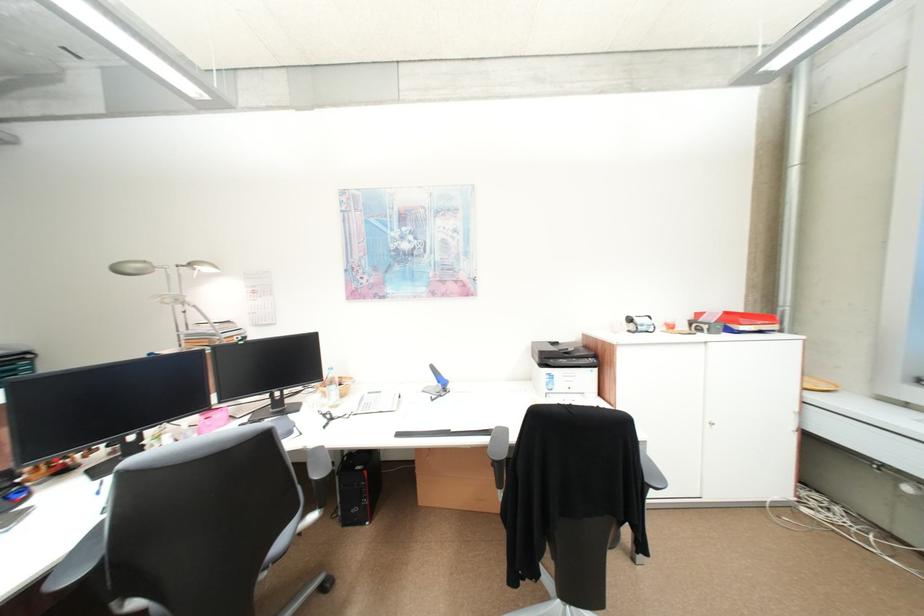
Where would you turn the white cabinet lock? Please return your answer as a coordinate pair (x, y).

(722, 429)